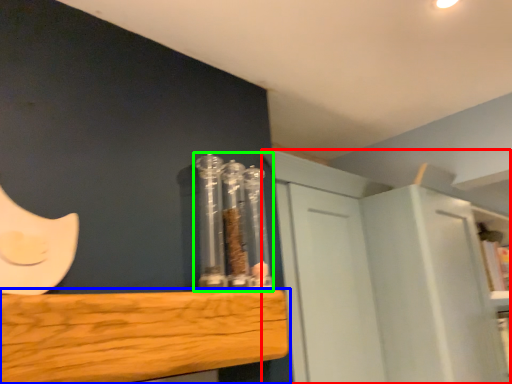
Question: Estimate the real-world distances between objects in this image. Which object is closer to cabinetry (highlighted by a red box), furniture (highlighted by a blue box) or glass jar (highlighted by a green box)?

Choices:
 (A) furniture
 (B) glass jar

Answer: (B)